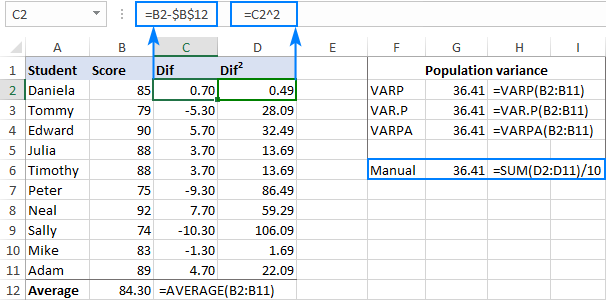
Where is `column`? This screenshot has height=300, width=606. column is located at coordinates (65, 46), (125, 45), (188, 44), (245, 43), (340, 48), (396, 46), (456, 46), (525, 42), (577, 43).